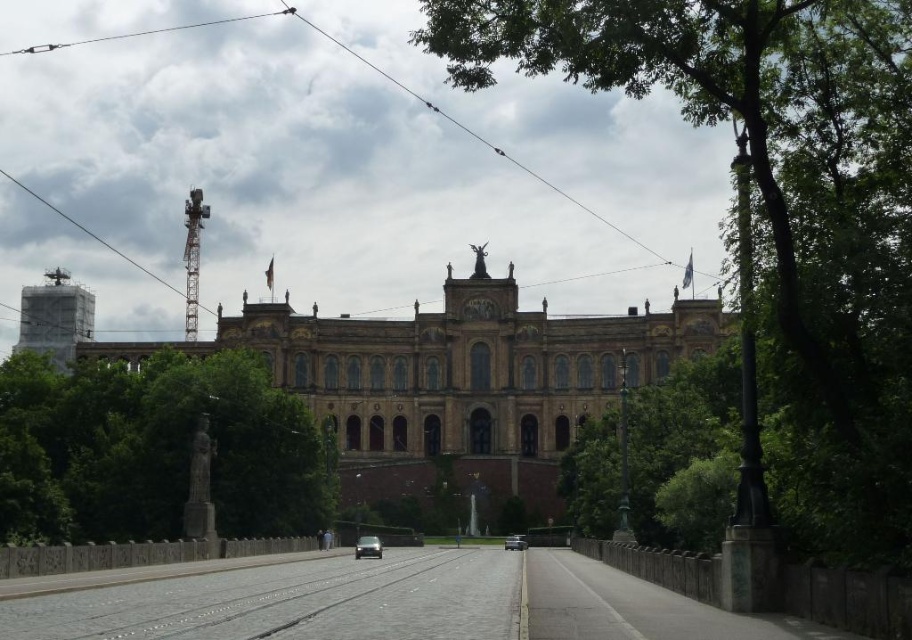
You are a tourist standing on the cobblestone street in front of the historic building. You notice a green leafy tree at upper right and a metallic silver car at center. Which object is positioned higher in the image?

The green leafy tree at upper right is located above the metallic silver car at center in the image.

You are standing at the center of the cobblestone street in front of the historic building. Looking towards the upper right corner of the image, can you see the green leafy tree at upper right? If so, where is it positioned relative to the statue on the roof?

The green leafy tree at upper right is located at point (775, 211), which places it to the right and slightly above the statue on the roof, making it visible in the upper right corner of the image.

You are a tourist standing in front of the historic building and want to take a photo that includes both the green leafy tree at upper right and the metallic silver car at center. Which object should you position closer to the front of your photo frame to ensure both are in the shot?

You should position the green leafy tree at upper right closer to the front of your photo frame since it is closer to the viewer than the metallic silver car at center, ensuring both are visible in the shot.